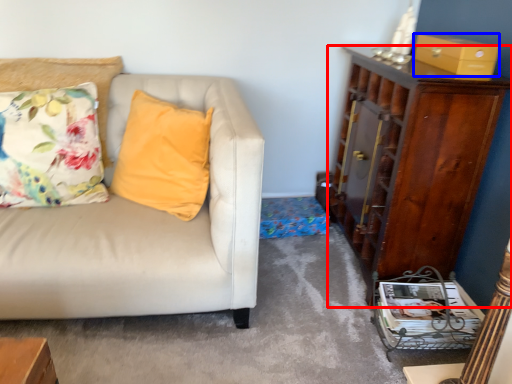
Question: Among these objects, which one is farthest to the camera, cabinetry (highlighted by a red box) or box (highlighted by a blue box)?

Choices:
 (A) cabinetry
 (B) box

Answer: (B)